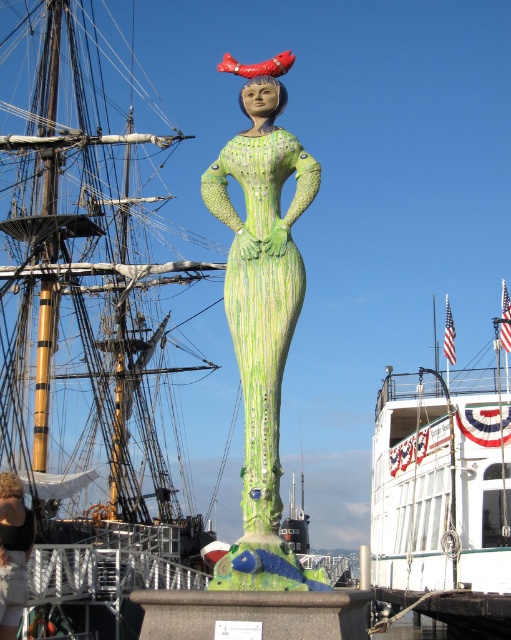
Which of these two, white glossy boat at lower right or black fabric person at lower left, stands taller?

white glossy boat at lower right

Who is positioned more to the right, white glossy boat at lower right or black fabric person at lower left?

white glossy boat at lower right is more to the right.

I want to click on white glossy boat at lower right, so click(x=445, y=497).

Is point (403, 467) behind point (266, 221)?

Yes.

Who is positioned more to the right, white glossy boat at lower right or green textured dress at center?

Positioned to the right is white glossy boat at lower right.

Which is behind, point (409, 540) or point (244, 182)?

Positioned behind is point (409, 540).

This screenshot has height=640, width=511. I want to click on white glossy boat at lower right, so click(445, 497).

Is green textured dress at center thinner than black fabric person at lower left?

No.

Can you confirm if green textured dress at center is wider than black fabric person at lower left?

Correct, the width of green textured dress at center exceeds that of black fabric person at lower left.

Which is in front, point (267, 216) or point (29, 524)?

Point (267, 216) is more forward.

Locate an element on the screen. The height and width of the screenshot is (640, 511). green textured dress at center is located at coordinates (262, 298).